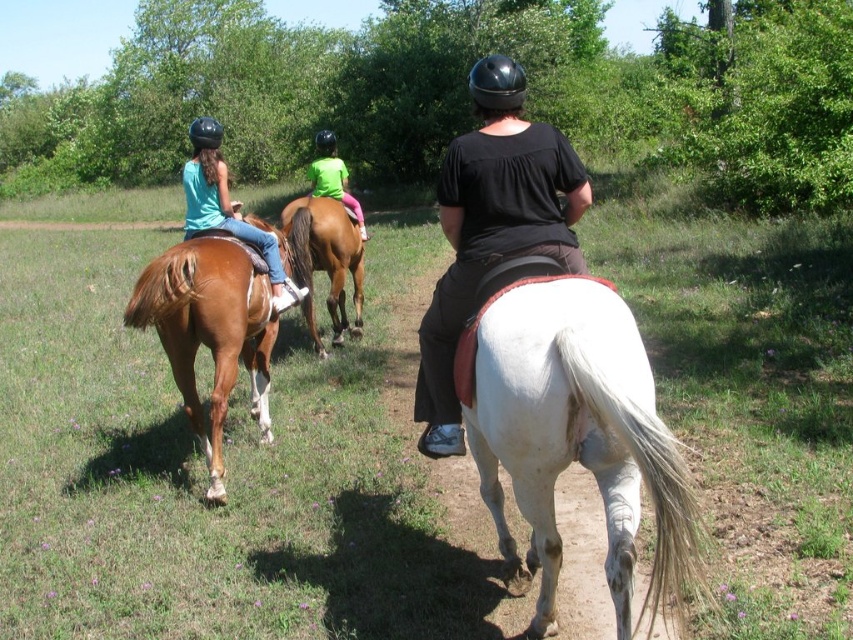
You are a photographer positioned at the origin point of the image. You want to capture a photo of the white smooth horse at center. What are the coordinates where you should aim your camera?

The coordinates to aim your camera are at point (573, 435) to capture the white smooth horse at center.

Based on the scene description, where is the black matte shirt at center located in terms of its 2D coordinates?

The black matte shirt at center is located at the 2D coordinates point (492,227).